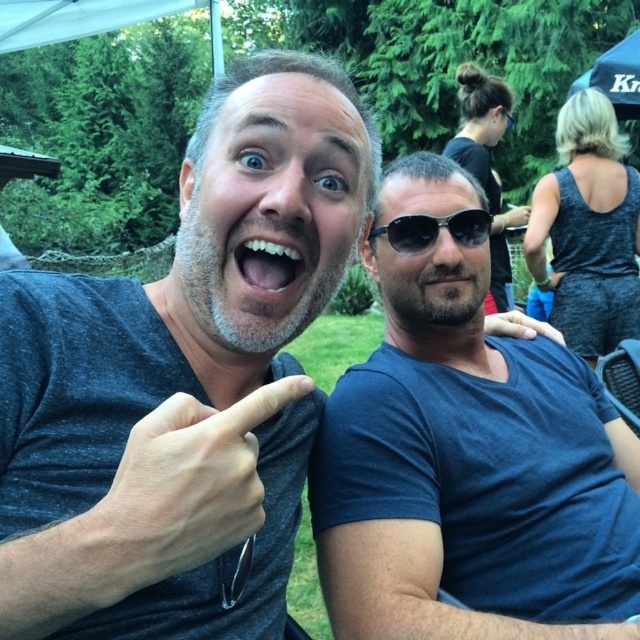
Question: From the image, what is the correct spatial relationship of gray fabric tank top at upper right in relation to matte black hand at upper right?

Choices:
 (A) above
 (B) below

Answer: (A)

Question: Which of the following is the farthest from the observer?

Choices:
 (A) black plastic sunglasses at center
 (B) blue fabric canopy at upper right
 (C) matte gray finger at center
 (D) matte black hand at upper right

Answer: (B)

Question: Is blue matte shirt at center above white glossy teeth at center?

Choices:
 (A) yes
 (B) no

Answer: (B)

Question: Is blue matte shirt at center bigger than blue fabric canopy at upper right?

Choices:
 (A) yes
 (B) no

Answer: (B)

Question: Among these points, which one is nearest to the camera?

Choices:
 (A) (230, 252)
 (B) (512, 212)
 (C) (620, 198)
 (D) (166, 484)

Answer: (D)

Question: Which of these objects is positioned closest to the matte black hand at upper right?

Choices:
 (A) gray matte t-shirt at center
 (B) blue fabric canopy at upper right
 (C) blue matte shirt at center
 (D) white glossy teeth at center

Answer: (B)